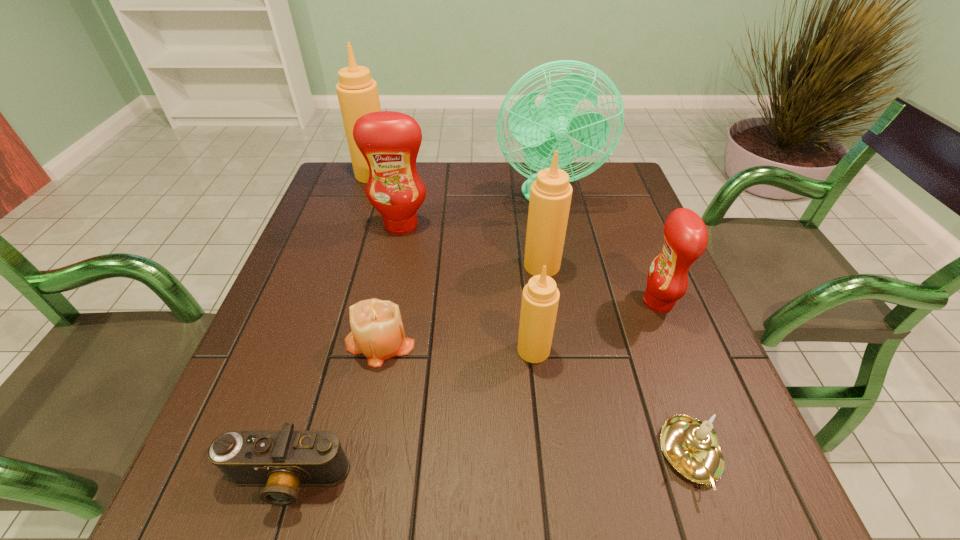
Identify the location of the fifth closest object relative to the fan. (377, 332).

The height and width of the screenshot is (540, 960). In order to click on object that is the fourth closest to the farthest tan condiment in this screenshot , I will do `click(377, 332)`.

Locate which condiment ranks in proximity to the candle holder. Please provide its 2D coordinates. Your answer should be formatted as a tuple, i.e. [(x, y)], where the tuple contains the x and y coordinates of a point satisfying the conditions above.

[(540, 297)]

Where is `the closest condiment to the farthest tan condiment`? The height and width of the screenshot is (540, 960). the closest condiment to the farthest tan condiment is located at coordinates (390, 141).

Find the location of a particular element. This screenshot has width=960, height=540. tan condiment that is the nearest to the second biggest tan condiment is located at coordinates (540, 297).

Identify which tan condiment is the second closest to the second farthest tan condiment. Please provide its 2D coordinates. Your answer should be formatted as a tuple, i.e. [(x, y)], where the tuple contains the x and y coordinates of a point satisfying the conditions above.

[(357, 92)]

You are a GUI agent. You are given a task and a screenshot of the screen. Output one action in this format:
    pyautogui.click(x=<x>, y=<y>)
    Task: Click on the vacant space that satisfies the following two spatial constraints: 1. on the label side of the farther red condiment; 2. on the left side of the candle
    Image resolution: width=960 pixels, height=540 pixels.
    Given the screenshot: What is the action you would take?
    pyautogui.click(x=376, y=342)

Identify the location of free space that satisfies the following two spatial constraints: 1. on the label side of the farther red condiment; 2. on the right side of the candle. The image size is (960, 540). (376, 342).

Find the location of `free location that satisfies the following two spatial constraints: 1. on the label side of the smaller red condiment; 2. on the handle side of the candle holder`. free location that satisfies the following two spatial constraints: 1. on the label side of the smaller red condiment; 2. on the handle side of the candle holder is located at coordinates coord(719,456).